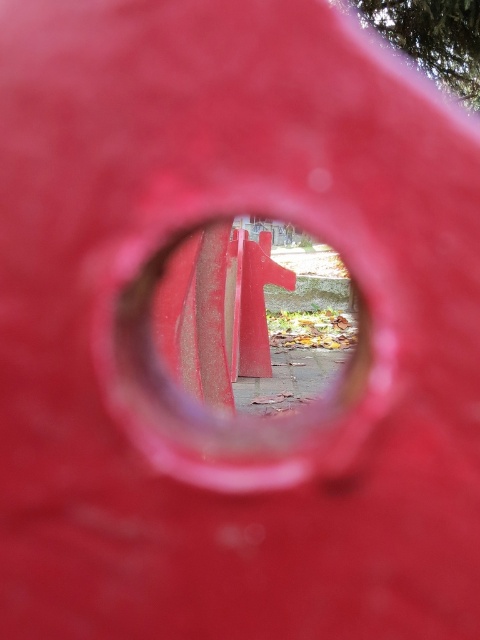
You are standing in front of a red structure with a circular hole. You notice a point marked at coordinates [220,342]. According to the scene description, what material is this point located on?

The point at [220,342] is on smooth matte wood at center.

You are a child trying to fit a small toy through the opening in the smooth matte wood at center and the smooth red traffic cone at center. Which object has a larger opening to allow the toy to pass through?

The smooth red traffic cone at center has a larger opening than the smooth matte wood at center, so the toy can pass through the smooth red traffic cone at center.